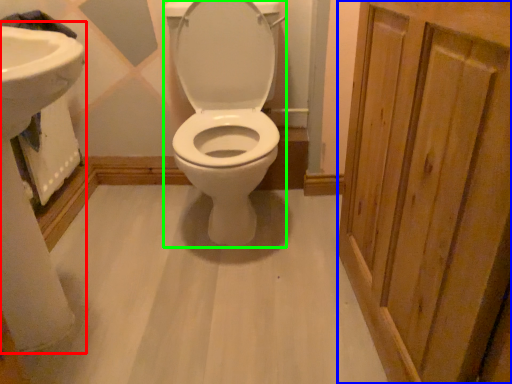
Question: Which object is the farthest from sink (highlighted by a red box)? Choose among these: screen door (highlighted by a blue box) or toilet (highlighted by a green box).

Choices:
 (A) screen door
 (B) toilet

Answer: (A)